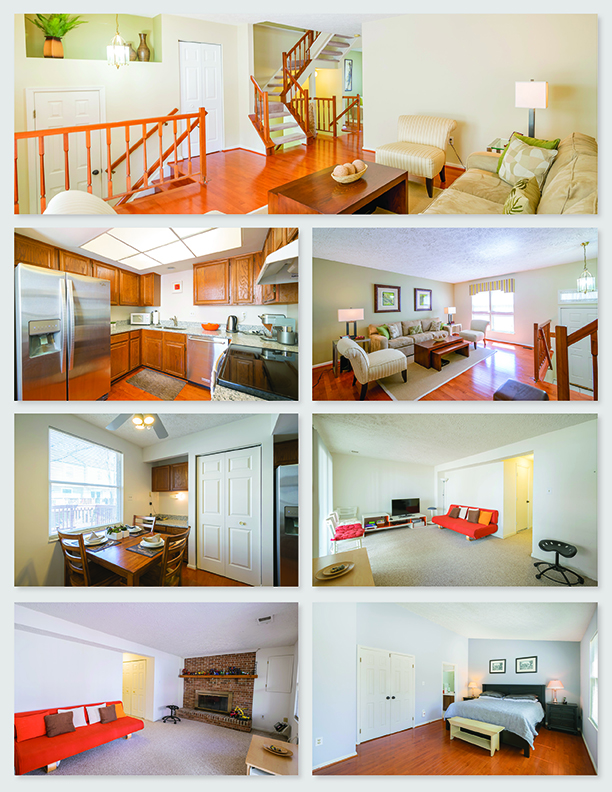
Find the location of `sofa`. sofa is located at coordinates (56, 747), (459, 523), (406, 337), (479, 185).